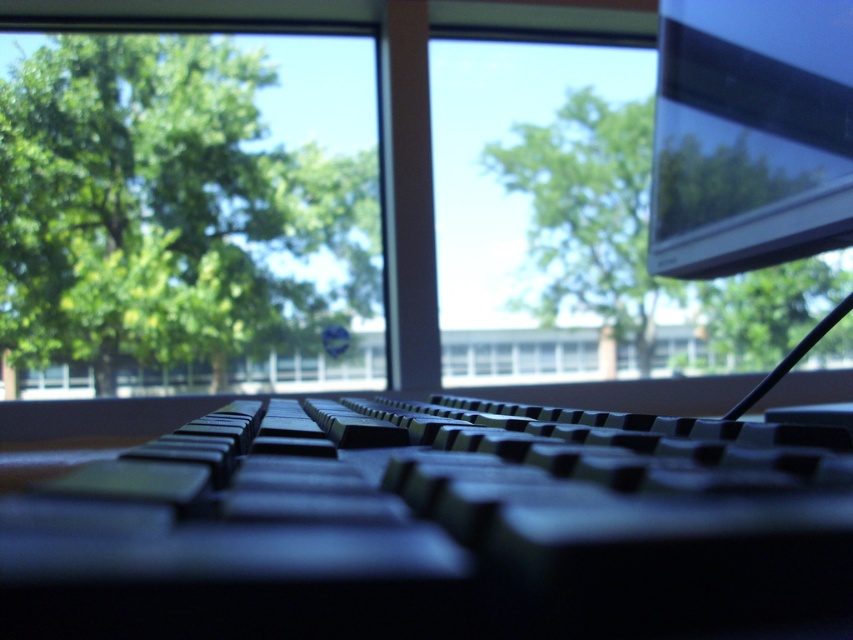
You are setting up a desk and need to know the relative sizes of the matte black monitor at upper right and the green leafy tree at upper center. Which object is taller?

The green leafy tree at upper center is taller than the matte black monitor at upper right.

You are setting up a desk and need to place the black plastic keyboard at center so it doesn t block the view of the green leafy tree at upper center. Based on their sizes, is this arrangement possible?

The black plastic keyboard at center is smaller than the green leafy tree at upper center, so arranging it in a way that doesn t block the view of the tree is possible since the keyboard takes up less space.